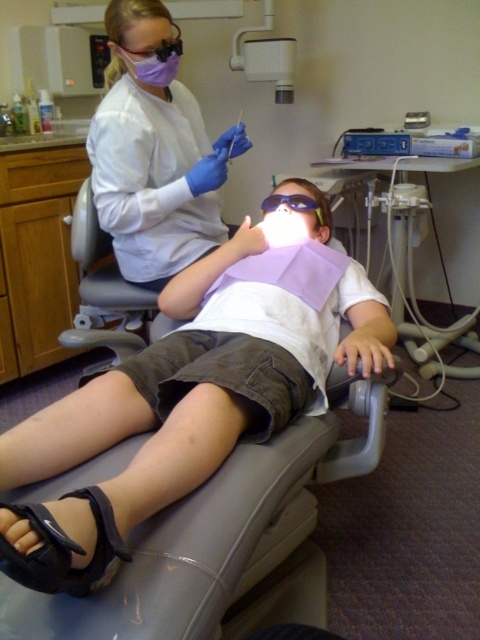
Can you confirm if white plastic dental chair at right is smaller than purple fabric mask at upper left?

No.

Does white plastic dental chair at right have a larger size compared to purple fabric mask at upper left?

Yes.

What are the coordinates of `white plastic dental chair at right` in the screenshot? It's located at (411, 236).

Where is `white plastic dental chair at right`? white plastic dental chair at right is located at coordinates (411, 236).

Which of these two, white plastic dental chair at right or blue matte goggles at center, stands shorter?

blue matte goggles at center

From the picture: Can you confirm if white plastic dental chair at right is wider than blue matte goggles at center?

Indeed, white plastic dental chair at right has a greater width compared to blue matte goggles at center.

Does point (399, 300) lie in front of point (311, 205)?

No, (399, 300) is behind (311, 205).

Where is `white plastic dental chair at right`? white plastic dental chair at right is located at coordinates (411, 236).

Which is above, purple fabric mask at upper left or blue matte goggles at center?

Positioned higher is purple fabric mask at upper left.

Is purple fabric mask at upper left to the right of blue matte goggles at center from the viewer's perspective?

Incorrect, purple fabric mask at upper left is not on the right side of blue matte goggles at center.

Who is more distant from viewer, (120, 65) or (295, 202)?

Point (120, 65)

Where is `purple fabric mask at upper left`? The width and height of the screenshot is (480, 640). purple fabric mask at upper left is located at coordinates (146, 52).